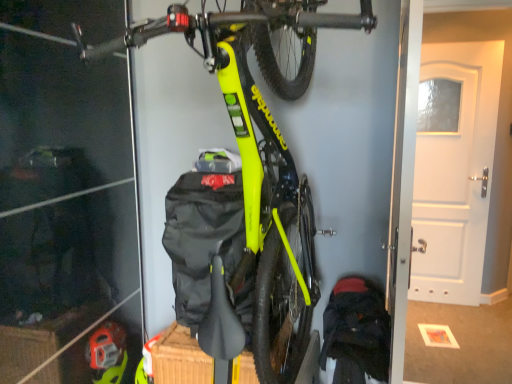
Question: Is the depth of white matte door at upper right less than that of neon yellow matte bicycle at center?

Choices:
 (A) no
 (B) yes

Answer: (A)

Question: Is white matte door at upper right shorter than neon yellow matte bicycle at center?

Choices:
 (A) yes
 (B) no

Answer: (B)

Question: Is white matte door at upper right further to the viewer compared to neon yellow matte bicycle at center?

Choices:
 (A) yes
 (B) no

Answer: (A)

Question: Is white matte door at upper right facing towards neon yellow matte bicycle at center?

Choices:
 (A) no
 (B) yes

Answer: (A)

Question: Could neon yellow matte bicycle at center be considered to be inside white matte door at upper right?

Choices:
 (A) no
 (B) yes

Answer: (A)

Question: From the image's perspective, is dark blue fabric backpack at lower right above or below neon yellow matte bicycle at center?

Choices:
 (A) below
 (B) above

Answer: (A)

Question: Considering the positions of dark blue fabric backpack at lower right and neon yellow matte bicycle at center in the image, is dark blue fabric backpack at lower right wider or thinner than neon yellow matte bicycle at center?

Choices:
 (A) wide
 (B) thin

Answer: (B)

Question: Does point (371, 337) appear closer or farther from the camera than point (254, 165)?

Choices:
 (A) farther
 (B) closer

Answer: (A)

Question: Do you think dark blue fabric backpack at lower right is within neon yellow matte bicycle at center, or outside of it?

Choices:
 (A) outside
 (B) inside

Answer: (B)

Question: In terms of width, does white matte door at upper right look wider or thinner when compared to dark blue fabric backpack at lower right?

Choices:
 (A) wide
 (B) thin

Answer: (B)

Question: From the image's perspective, is white matte door at upper right above or below dark blue fabric backpack at lower right?

Choices:
 (A) below
 (B) above

Answer: (B)

Question: Is white matte door at upper right in front of or behind dark blue fabric backpack at lower right in the image?

Choices:
 (A) front
 (B) behind

Answer: (B)

Question: Considering the positions of white matte door at upper right and dark blue fabric backpack at lower right in the image, is white matte door at upper right taller or shorter than dark blue fabric backpack at lower right?

Choices:
 (A) tall
 (B) short

Answer: (A)

Question: Considering the positions of point (189, 41) and point (330, 357), is point (189, 41) closer or farther from the camera than point (330, 357)?

Choices:
 (A) farther
 (B) closer

Answer: (B)

Question: From a real-world perspective, is neon yellow matte bicycle at center above or below dark blue fabric backpack at lower right?

Choices:
 (A) below
 (B) above

Answer: (B)